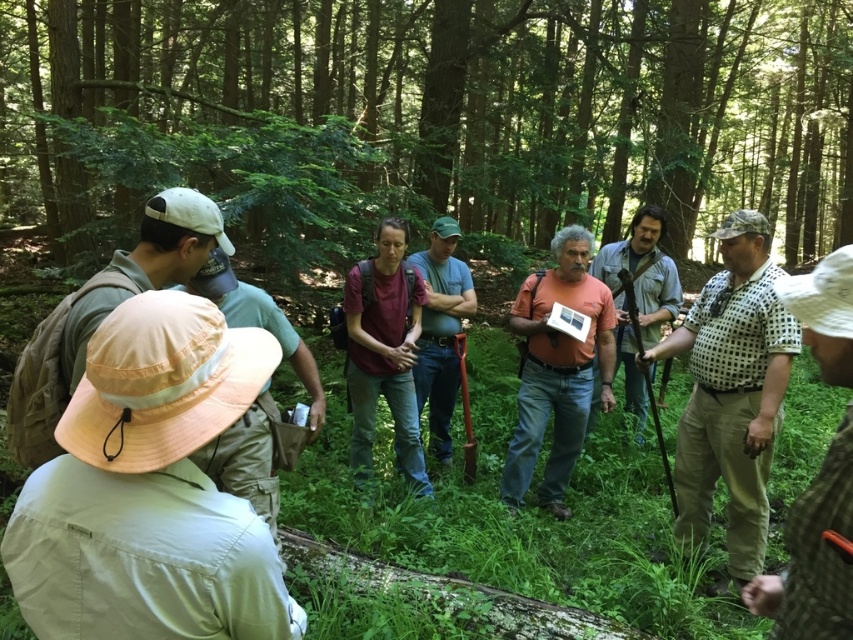
Who is positioned more to the left, green leafy tree at center or matte brown shirt at center?

From the viewer's perspective, matte brown shirt at center appears more on the left side.

Is green leafy tree at center wider than matte brown shirt at center?

Yes, green leafy tree at center is wider than matte brown shirt at center.

Is point (184, 60) closer to viewer compared to point (440, 262)?

No, it is behind (440, 262).

Where is `green leafy tree at center`? This screenshot has height=640, width=853. green leafy tree at center is located at coordinates (461, 104).

Is maroon fabric shirt at center positioned in front of matte brown shirt at center?

Yes, maroon fabric shirt at center is in front of matte brown shirt at center.

Does maroon fabric shirt at center have a larger size compared to matte brown shirt at center?

No, maroon fabric shirt at center is not bigger than matte brown shirt at center.

Is point (386, 358) less distant than point (448, 406)?

Yes, it is.

Find the location of a particular element. Image resolution: width=853 pixels, height=640 pixels. maroon fabric shirt at center is located at coordinates tap(384, 352).

Which of these two, orange matte shirt at center or matte brown shirt at center, stands taller?

orange matte shirt at center is taller.

Does orange matte shirt at center have a smaller size compared to matte brown shirt at center?

Answer: Indeed, orange matte shirt at center has a smaller size compared to matte brown shirt at center.

Is point (544, 298) closer to viewer compared to point (457, 298)?

Yes.

In order to click on orange matte shirt at center in this screenshot , I will do `click(556, 371)`.